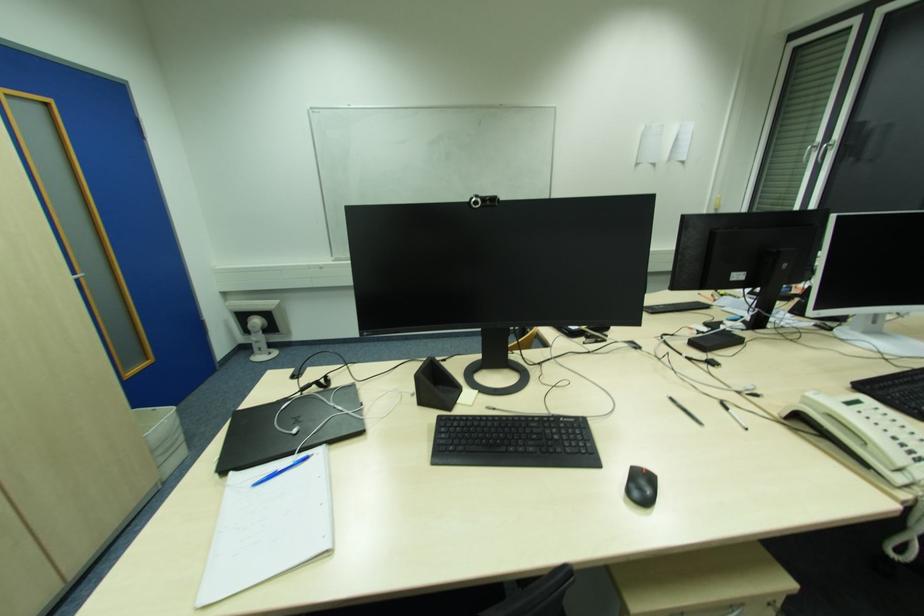
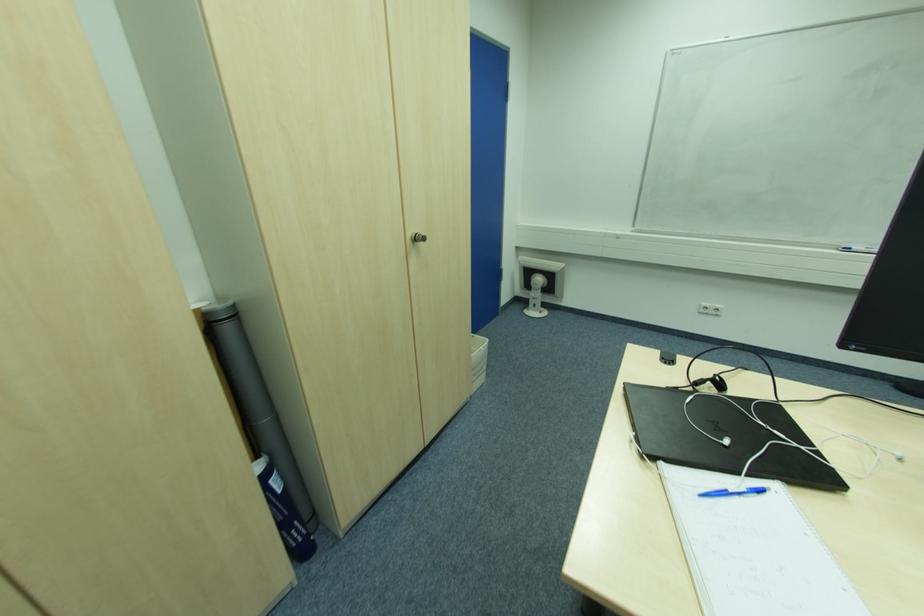
The point at (259, 342) is marked in the first image. Where is the corresponding point in the second image?

(536, 300)